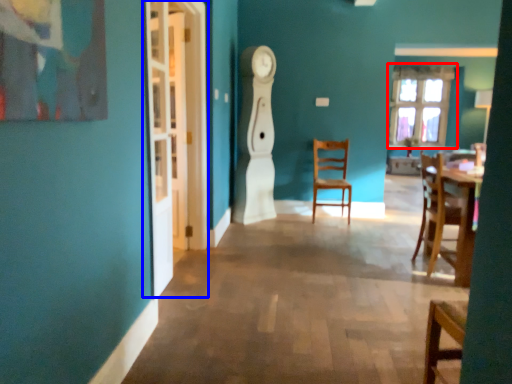
Question: Which object is closer to the camera taking this photo, window (highlighted by a red box) or glass door (highlighted by a blue box)?

Choices:
 (A) window
 (B) glass door

Answer: (B)